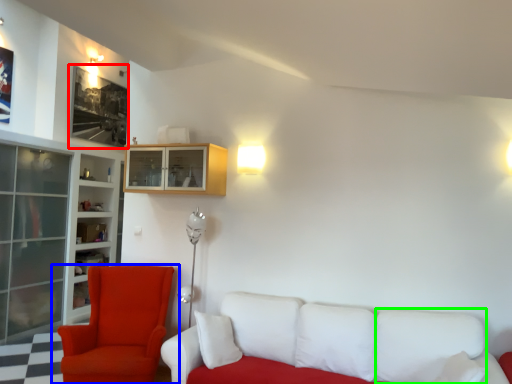
Question: Which object is positioned closest to picture frame (highlighted by a red box)? Select from chair (highlighted by a blue box) and pillow (highlighted by a green box).

Choices:
 (A) chair
 (B) pillow

Answer: (A)